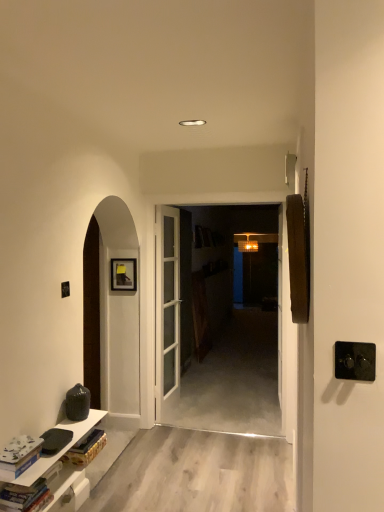
Identify the location of vacant space situated above white matte book at lower left, the 2th book from the bottom (from a real-world perspective). (14, 445).